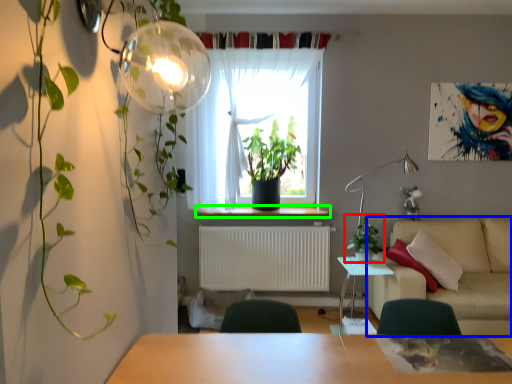
Question: Estimate the real-world distances between objects in this image. Which object is farther from houseplant (highlighted by a red box), studio couch (highlighted by a blue box) or window sill (highlighted by a green box)?

Choices:
 (A) studio couch
 (B) window sill

Answer: (B)